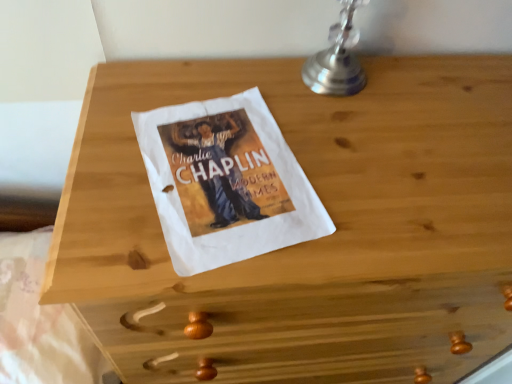
Find the location of a particular element. vacant area that lies in front of silver metallic table lamp at upper right is located at coordinates (332, 140).